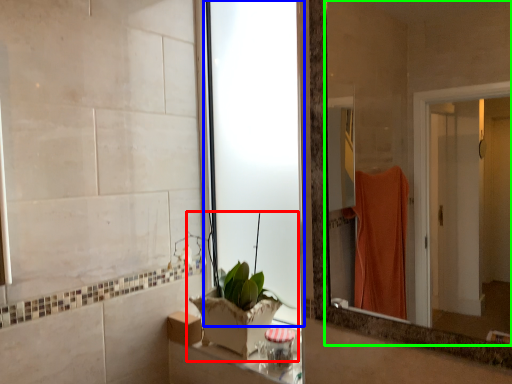
Question: Which object is positioned farthest from houseplant (highlighted by a red box)? Select from glass door (highlighted by a blue box) and mirror (highlighted by a green box).

Choices:
 (A) glass door
 (B) mirror

Answer: (B)